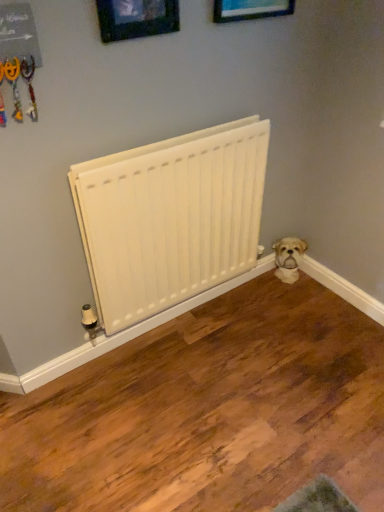
Describe the element at coordinates (250, 9) in the screenshot. This screenshot has height=512, width=384. I see `wooden picture frame at upper center, arranged as the 2th picture frame when viewed from the left` at that location.

Locate an element on the screen. Image resolution: width=384 pixels, height=512 pixels. wooden picture frame at upper center, which appears as the 2th picture frame when viewed from the right is located at coordinates (136, 18).

Locate an element on the screen. This screenshot has height=512, width=384. wooden picture frame at upper center, which is the 1th picture frame from right to left is located at coordinates (250, 9).

In terms of width, does white fluffy dog at lower right look wider or thinner when compared to white matte radiator at center?

Clearly, white fluffy dog at lower right has more width compared to white matte radiator at center.

Looking at this image, can you confirm if white fluffy dog at lower right is bigger than white matte radiator at center?

Actually, white fluffy dog at lower right might be smaller than white matte radiator at center.

Considering the positions of point (289, 251) and point (144, 302), is point (289, 251) closer or farther from the camera than point (144, 302)?

Point (289, 251) appears to be farther away from the viewer than point (144, 302).

Is wooden picture frame at upper center, arranged as the 2th picture frame when viewed from the left, inside white matte radiator at center?

No, white matte radiator at center does not contain wooden picture frame at upper center, arranged as the 2th picture frame when viewed from the left.

Can you confirm if white matte radiator at center is smaller than wooden picture frame at upper center, which is the 1th picture frame from right to left?

No, white matte radiator at center is not smaller than wooden picture frame at upper center, which is the 1th picture frame from right to left.

From a real-world perspective, is white matte radiator at center physically located above or below wooden picture frame at upper center, which is the 1th picture frame from right to left?

white matte radiator at center is below wooden picture frame at upper center, which is the 1th picture frame from right to left.

Locate an element on the screen. radiator that is below the wooden picture frame at upper center, arranged as the 2th picture frame when viewed from the left (from the image's perspective) is located at coordinates (170, 218).

Which object is further away from the camera, wooden picture frame at upper center, which appears as the 2th picture frame when viewed from the right, or white fluffy dog at lower right?

white fluffy dog at lower right is further away from the camera.

How different are the orientations of wooden picture frame at upper center, the 1th picture frame in the left-to-right sequence, and white fluffy dog at lower right in degrees?

There is a 43-degree angle between the facing directions of wooden picture frame at upper center, the 1th picture frame in the left-to-right sequence, and white fluffy dog at lower right.

Consider the image. Is wooden picture frame at upper center, the 1th picture frame in the left-to-right sequence, next to white fluffy dog at lower right and touching it?

No, wooden picture frame at upper center, the 1th picture frame in the left-to-right sequence, is not with white fluffy dog at lower right.

Could you tell me if wooden picture frame at upper center, arranged as the 2th picture frame when viewed from the left, is facing white fluffy dog at lower right?

No, wooden picture frame at upper center, arranged as the 2th picture frame when viewed from the left, is not oriented towards white fluffy dog at lower right.

Can you confirm if wooden picture frame at upper center, arranged as the 2th picture frame when viewed from the left, is smaller than white fluffy dog at lower right?

Yes.

Who is shorter, wooden picture frame at upper center, which is the 1th picture frame from right to left, or white fluffy dog at lower right?

white fluffy dog at lower right is shorter.

Is wooden picture frame at upper center, which is the 1th picture frame from right to left, far from white fluffy dog at lower right?

Yes, wooden picture frame at upper center, which is the 1th picture frame from right to left, and white fluffy dog at lower right are located far from each other.

From the image's perspective, which is above, wooden picture frame at upper center, the 1th picture frame in the left-to-right sequence, or wooden picture frame at upper center, arranged as the 2th picture frame when viewed from the left?

wooden picture frame at upper center, arranged as the 2th picture frame when viewed from the left, appears higher in the image.

Is wooden picture frame at upper center, the 1th picture frame in the left-to-right sequence, touching wooden picture frame at upper center, which is the 1th picture frame from right to left?

No, wooden picture frame at upper center, the 1th picture frame in the left-to-right sequence, is not touching wooden picture frame at upper center, which is the 1th picture frame from right to left.

Is wooden picture frame at upper center, which appears as the 2th picture frame when viewed from the right, wider than wooden picture frame at upper center, which is the 1th picture frame from right to left?

Incorrect, the width of wooden picture frame at upper center, which appears as the 2th picture frame when viewed from the right, does not surpass that of wooden picture frame at upper center, which is the 1th picture frame from right to left.

From a real-world perspective, between wooden picture frame at upper center, which appears as the 2th picture frame when viewed from the right, and wooden picture frame at upper center, which is the 1th picture frame from right to left, who is vertically lower?

In real-world perspective, wooden picture frame at upper center, which appears as the 2th picture frame when viewed from the right, is lower.

Consider the image. Which is behind, wooden picture frame at upper center, which is the 1th picture frame from right to left, or white matte radiator at center?

white matte radiator at center.

Looking at this image, can you confirm if wooden picture frame at upper center, which is the 1th picture frame from right to left, is wider than white matte radiator at center?

Incorrect, the width of wooden picture frame at upper center, which is the 1th picture frame from right to left, does not surpass that of white matte radiator at center.

How much distance is there between wooden picture frame at upper center, which is the 1th picture frame from right to left, and white matte radiator at center?

wooden picture frame at upper center, which is the 1th picture frame from right to left, and white matte radiator at center are 26.02 inches apart from each other.

Where is `the 1st picture frame in front of the white matte radiator at center, counting from the anchor's position`? This screenshot has width=384, height=512. the 1st picture frame in front of the white matte radiator at center, counting from the anchor's position is located at coordinates (250, 9).

From a real-world perspective, which is physically below, wooden picture frame at upper center, which appears as the 2th picture frame when viewed from the right, or white matte radiator at center?

white matte radiator at center is physically lower.

Would you say wooden picture frame at upper center, which appears as the 2th picture frame when viewed from the right, is outside white matte radiator at center?

wooden picture frame at upper center, which appears as the 2th picture frame when viewed from the right, is positioned outside white matte radiator at center.

Is white matte radiator at center at the back of wooden picture frame at upper center, the 1th picture frame in the left-to-right sequence?

No.

In the image, is wooden picture frame at upper center, which appears as the 2th picture frame when viewed from the right, on the left side or the right side of white matte radiator at center?

From the image, it's evident that wooden picture frame at upper center, which appears as the 2th picture frame when viewed from the right, is to the left of white matte radiator at center.

Image resolution: width=384 pixels, height=512 pixels. I want to click on radiator to the left of white fluffy dog at lower right, so click(170, 218).

There is a white matte radiator at center. In order to click on the 2nd picture frame above it (from the image's perspective) in this screenshot , I will do `click(250, 9)`.

When comparing their distances from wooden picture frame at upper center, the 1th picture frame in the left-to-right sequence, does white matte radiator at center or wooden picture frame at upper center, arranged as the 2th picture frame when viewed from the left, seem closer?

wooden picture frame at upper center, arranged as the 2th picture frame when viewed from the left.

From the picture: Looking at the image, which one is located further to white fluffy dog at lower right, wooden picture frame at upper center, the 1th picture frame in the left-to-right sequence, or white matte radiator at center?

A: wooden picture frame at upper center, the 1th picture frame in the left-to-right sequence, is further to white fluffy dog at lower right.

From the image, which object appears to be farther from wooden picture frame at upper center, which appears as the 2th picture frame when viewed from the right, white matte radiator at center or white fluffy dog at lower right?

Based on the image, white fluffy dog at lower right appears to be further to wooden picture frame at upper center, which appears as the 2th picture frame when viewed from the right.

Which object lies nearer to the anchor point wooden picture frame at upper center, which appears as the 2th picture frame when viewed from the right, white fluffy dog at lower right or white matte radiator at center?

white matte radiator at center lies closer to wooden picture frame at upper center, which appears as the 2th picture frame when viewed from the right, than the other object.

Estimate the real-world distances between objects in this image. Which object is further from white matte radiator at center, wooden picture frame at upper center, the 1th picture frame in the left-to-right sequence, or white fluffy dog at lower right?

white fluffy dog at lower right.

Considering their positions, is wooden picture frame at upper center, which is the 1th picture frame from right to left, positioned closer to white fluffy dog at lower right than white matte radiator at center?

white matte radiator at center is positioned closer to the anchor white fluffy dog at lower right.

Considering their positions, is white matte radiator at center positioned closer to wooden picture frame at upper center, which is the 1th picture frame from right to left, than white fluffy dog at lower right?

white matte radiator at center lies closer to wooden picture frame at upper center, which is the 1th picture frame from right to left, than the other object.

Which object lies nearer to the anchor point wooden picture frame at upper center, the 1th picture frame in the left-to-right sequence, wooden picture frame at upper center, which is the 1th picture frame from right to left, or white fluffy dog at lower right?

wooden picture frame at upper center, which is the 1th picture frame from right to left, is positioned closer to the anchor wooden picture frame at upper center, the 1th picture frame in the left-to-right sequence.

Find the location of a particular element. The image size is (384, 512). picture frame between wooden picture frame at upper center, which is the 1th picture frame from right to left, and white matte radiator at center vertically is located at coordinates (136, 18).

You are a GUI agent. You are given a task and a screenshot of the screen. Output one action in this format:
    pyautogui.click(x=<x>, y=<y>)
    Task: Click on the picture frame located between wooden picture frame at upper center, the 1th picture frame in the left-to-right sequence, and white fluffy dog at lower right in the depth direction
    
    Given the screenshot: What is the action you would take?
    pyautogui.click(x=250, y=9)

Where is `radiator located between wooden picture frame at upper center, which appears as the 2th picture frame when viewed from the right, and white fluffy dog at lower right in the depth direction`? radiator located between wooden picture frame at upper center, which appears as the 2th picture frame when viewed from the right, and white fluffy dog at lower right in the depth direction is located at coordinates (170, 218).

Identify the location of radiator between wooden picture frame at upper center, which is the 1th picture frame from right to left, and white fluffy dog at lower right, in the vertical direction. (170, 218).